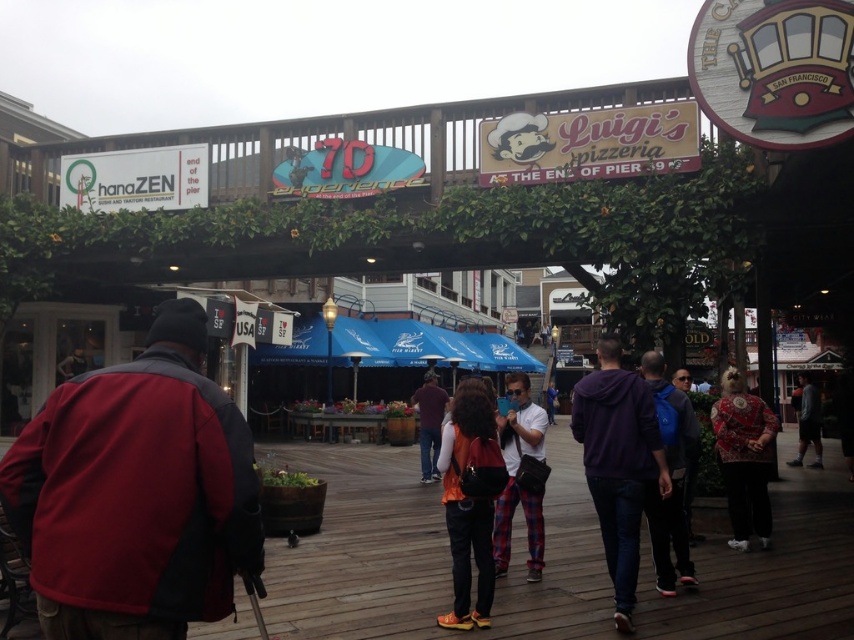
At what (x,y) coordinates should I click in order to perform the action: click on blue fabric jacket at center. Please return your answer as a coordinate pair (x, y). Looking at the image, I should click on (670, 477).

Between blue fabric jacket at center and dark gray hoodie at lower right, which one has more height?

With more height is blue fabric jacket at center.

Is point (677, 452) positioned in front of point (806, 428)?

Yes, point (677, 452) is in front of point (806, 428).

In order to click on blue fabric jacket at center in this screenshot , I will do `click(670, 477)`.

Does red fleece jacket at left appear under plaid pants at center?

No.

Who is higher up, red fleece jacket at left or plaid pants at center?

red fleece jacket at left is above.

Find the location of a particular element. This screenshot has height=640, width=854. red fleece jacket at left is located at coordinates (137, 493).

Which is in front, point (749, 484) or point (436, 416)?

Point (749, 484) is more forward.

What do you see at coordinates (744, 458) in the screenshot? This screenshot has width=854, height=640. I see `patterned fabric jacket at right` at bounding box center [744, 458].

Identify the location of patterned fabric jacket at right. This screenshot has height=640, width=854. (744, 458).

Identify the location of patterned fabric jacket at right. This screenshot has height=640, width=854. (744, 458).